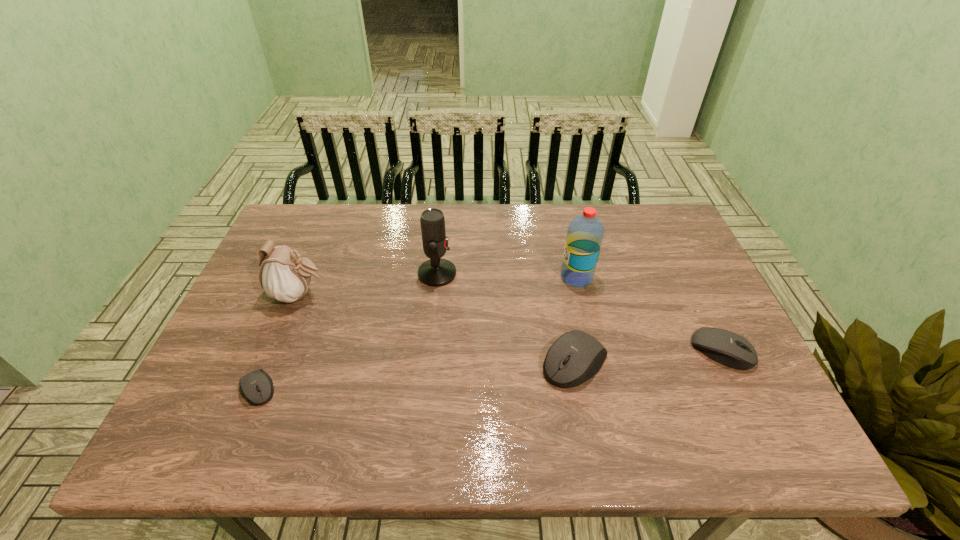
This screenshot has width=960, height=540. Find the location of `free space for an extra mouse_(computer_equipment) to achieve even spacing`. free space for an extra mouse_(computer_equipment) to achieve even spacing is located at coordinates 420,375.